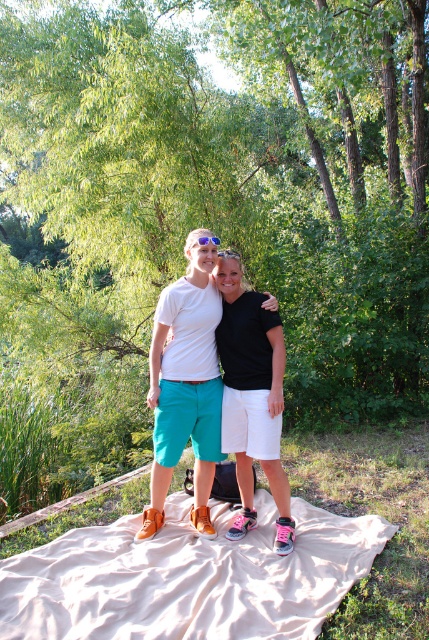
You are planning to set up a picnic and need to place a basket on the beige fabric blanket at lower center. However, there are black matte shorts at center nearby. Based on their positions, can you determine if the basket will fit on the blanket without overlapping the shorts?

The beige fabric blanket at lower center is to the left of black matte shorts at center, so placing the basket on the blanket should avoid overlapping the shorts as they are positioned to the right of the blanket.

You are trying to decide which item to place in a small gift box that can only hold items up to the size of the blue reflective lens sunglasses at center. Based on their sizes, can the matte teal shorts at center fit into the box?

The matte teal shorts at center has a larger size compared to blue reflective lens sunglasses at center, so it cannot fit into the gift box designed for items up to the size of the blue reflective lens sunglasses at center.

You are a photographer trying to capture a closeup shot of the blue reflective lens sunglasses at center. You notice the matte teal shorts at center might block your view. Based on their positions, can you determine if the sunglasses are visible from your current angle?

The matte teal shorts at center has a greater height compared to blue reflective lens sunglasses at center. Since the shorts are taller, they might block the view of the sunglasses if they are positioned in front of them.